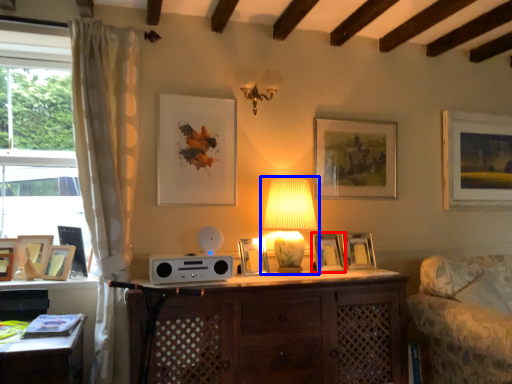
Question: Which object is further to the camera taking this photo, picture frame (highlighted by a red box) or lamp (highlighted by a blue box)?

Choices:
 (A) picture frame
 (B) lamp

Answer: (A)